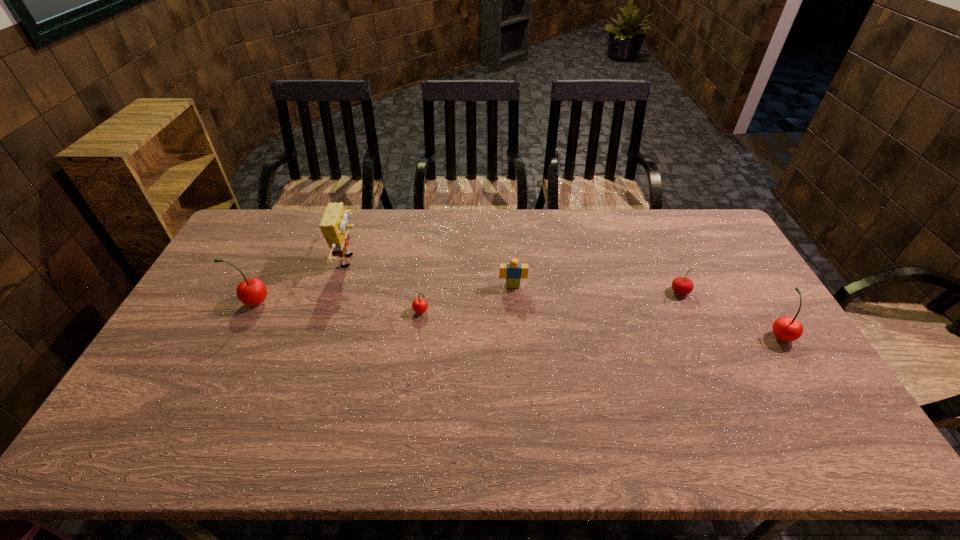
Identify the location of blank space located on the back of the fifth object from left to right. This screenshot has width=960, height=540. (656, 238).

Find the location of a particular element. The height and width of the screenshot is (540, 960). blank area located 0.140m on the face of the fifth object from right to left is located at coordinates (403, 261).

Locate an element on the screen. The image size is (960, 540). vacant space situated 0.140m on the face of the third object from right to left is located at coordinates (516, 323).

Locate an element on the screen. object that is at the far edge is located at coordinates (333, 225).

Find the location of `object present at the left edge`. object present at the left edge is located at coordinates (252, 291).

Where is `object positioned at the right edge`? object positioned at the right edge is located at coordinates (785, 328).

Where is `free spot at the far edge of the desktop`? free spot at the far edge of the desktop is located at coordinates (363, 219).

In the image, there is a desktop. Where is `blank space at the near edge`? The height and width of the screenshot is (540, 960). blank space at the near edge is located at coordinates (245, 399).

This screenshot has width=960, height=540. What are the coordinates of `vacant space at the left edge of the desktop` in the screenshot? It's located at (212, 350).

Where is `vacant area at the right edge of the desktop`? This screenshot has width=960, height=540. vacant area at the right edge of the desktop is located at coordinates coord(731,279).